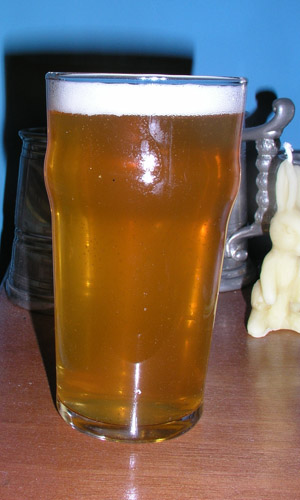
Where is `base of glass`? base of glass is located at coordinates (131, 436).